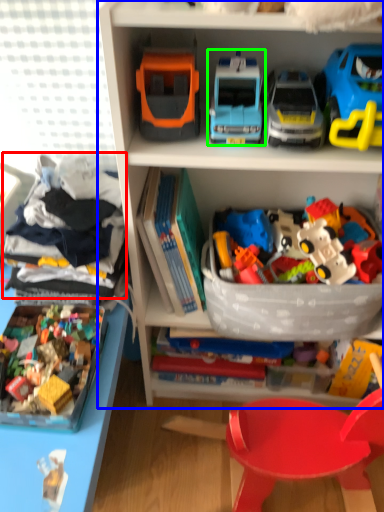
Question: Which is farther away from clothing (highlighted by a red box)? bookcase (highlighted by a blue box) or toy (highlighted by a green box)?

Choices:
 (A) bookcase
 (B) toy

Answer: (B)